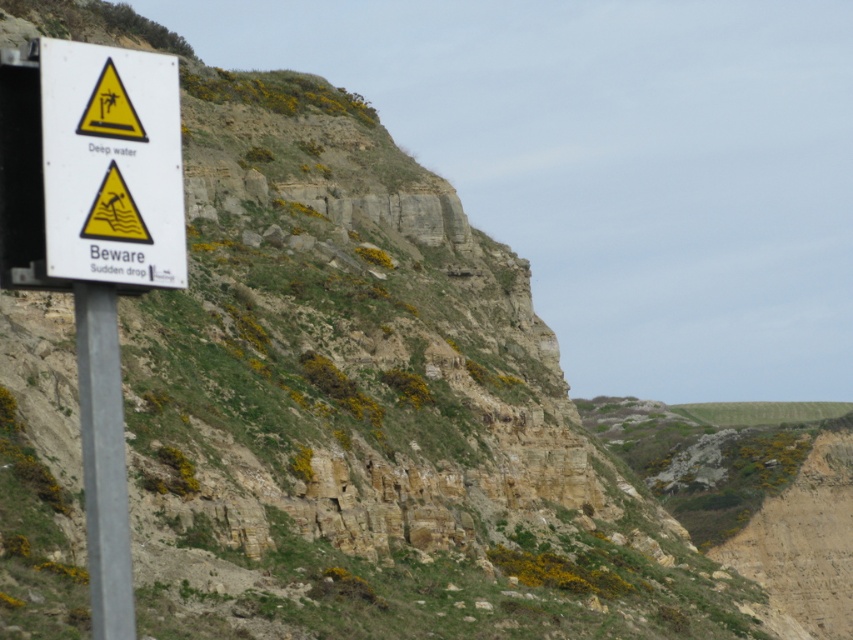
You are standing at the cliff edge and want to move towards the signpost. Which point, point (x=146, y=141) or point (x=175, y=234), is closer to the signpost?

Point (x=146, y=141) is in front of point (x=175, y=234), so it is closer to the signpost.

You are a hiker standing at the base of the cliffs and see the white plastic sign at left and the metallic pole at left. Which object is closer to you?

The white plastic sign at left is closer to you than the metallic pole at left because it is further to the viewer.